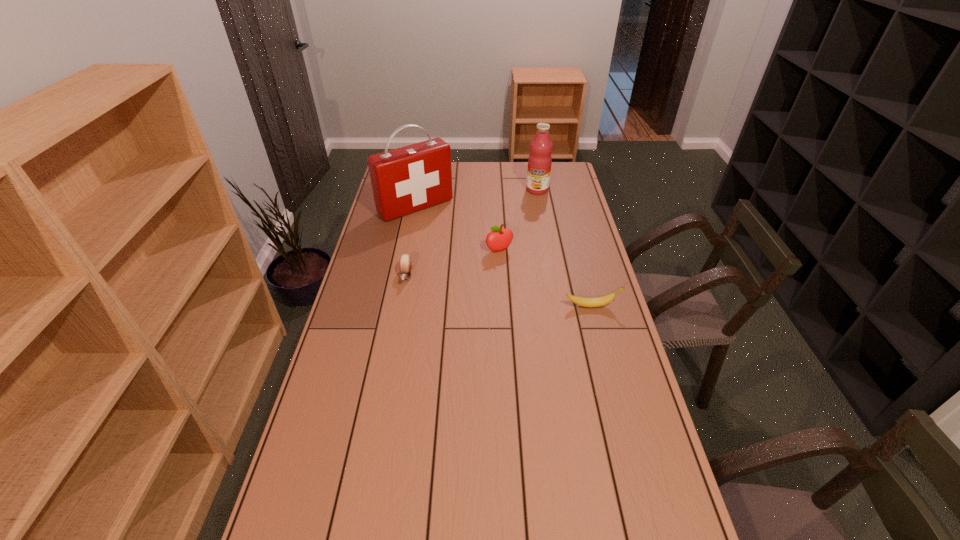
Find the location of a particular element. This screenshot has width=960, height=540. vacant region that satisfies the following two spatial constraints: 1. on the front side of the fruit juice; 2. at the stem of the banana is located at coordinates (559, 306).

I want to click on free spot that satisfies the following two spatial constraints: 1. on the front side of the tallest object; 2. at the stem of the banana, so click(396, 306).